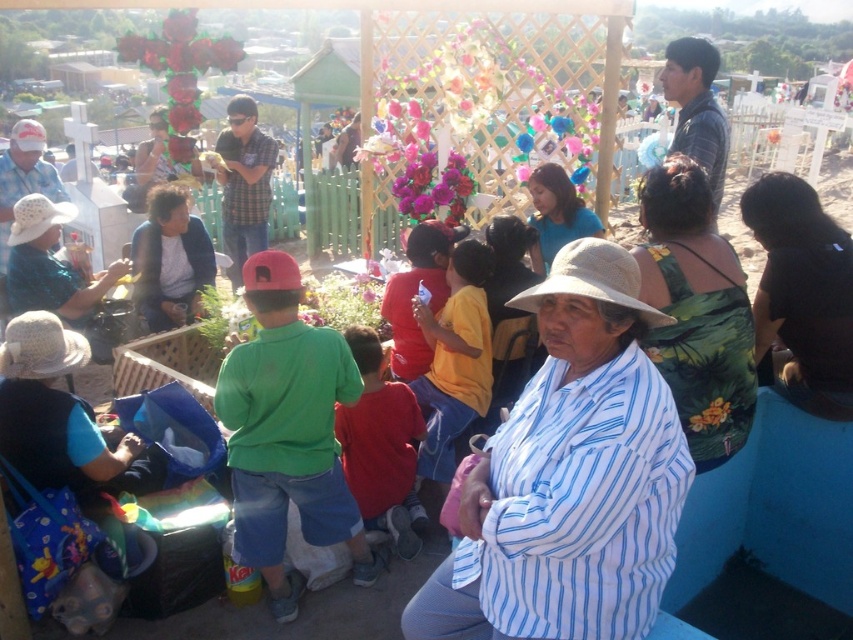
Can you confirm if red cotton shirt at center is wider than black fabric cap at center?

Yes.

Looking at this image, does red cotton shirt at center appear on the left side of black fabric cap at center?

In fact, red cotton shirt at center is to the right of black fabric cap at center.

Between point (412, 522) and point (259, 282), which one is positioned behind?

Point (412, 522)

At what (x,y) coordinates should I click in order to perform the action: click on red cotton shirt at center. Please return your answer as a coordinate pair (x, y). Image resolution: width=853 pixels, height=640 pixels. Looking at the image, I should click on (381, 448).

Who is higher up, red cotton shirt at center or matte blue sweater at center?

matte blue sweater at center is above.

Locate an element on the screen. red cotton shirt at center is located at coordinates (381, 448).

The height and width of the screenshot is (640, 853). Describe the element at coordinates (381, 448) in the screenshot. I see `red cotton shirt at center` at that location.

Is red cotton shirt at center bigger than white woven hat at left?

Yes.

The width and height of the screenshot is (853, 640). In order to click on red cotton shirt at center in this screenshot , I will do `click(381, 448)`.